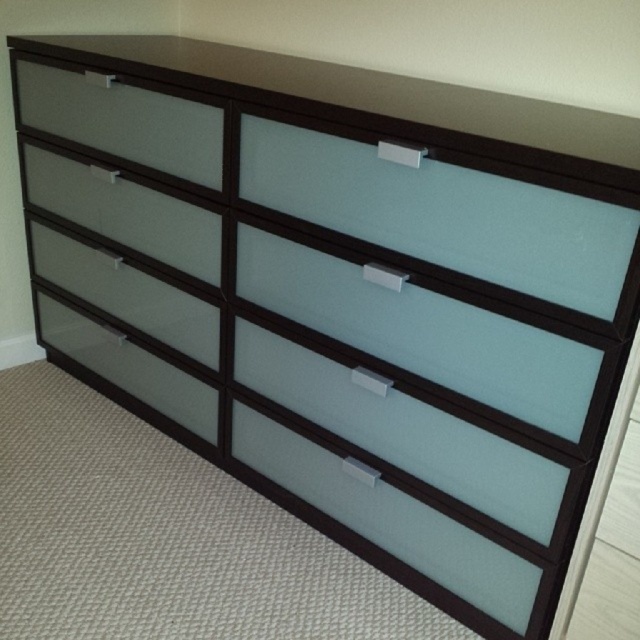
You are organizing your bedroom and have two drawers to choose from. The satin glass drawer at lower left and the frosted glass drawer at lower left. Which drawer has more space inside?

The satin glass drawer at lower left has a larger size compared to the frosted glass drawer at lower left, so it has more space inside.

You are standing in front of the modern dresser and want to locate the satin glass drawer at upper left. According to the coordinate system where the bottom left corner of the image is the origin, can you tell me its position?

The satin glass drawer at upper left is located at point coordinates of (125, 211).

You are organizing your room and see the satin glass drawer at lower left and the frosted glass drawer at lower left. Which one is positioned more to the right side?

The satin glass drawer at lower left is positioned more to the right side than the frosted glass drawer at lower left.